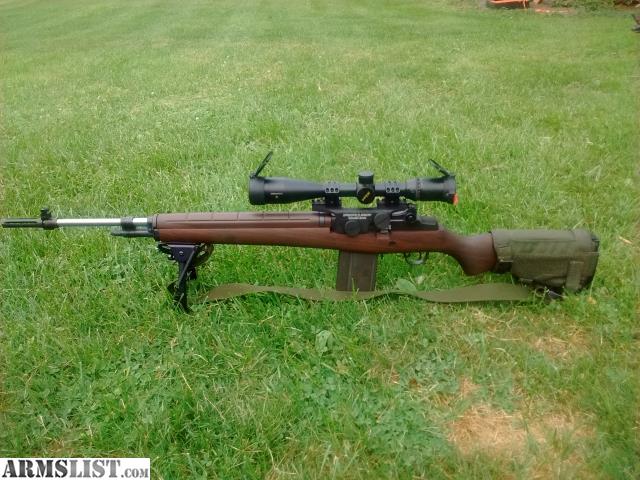
This screenshot has height=480, width=640. In order to click on handle in this screenshot , I will do `click(472, 259)`.